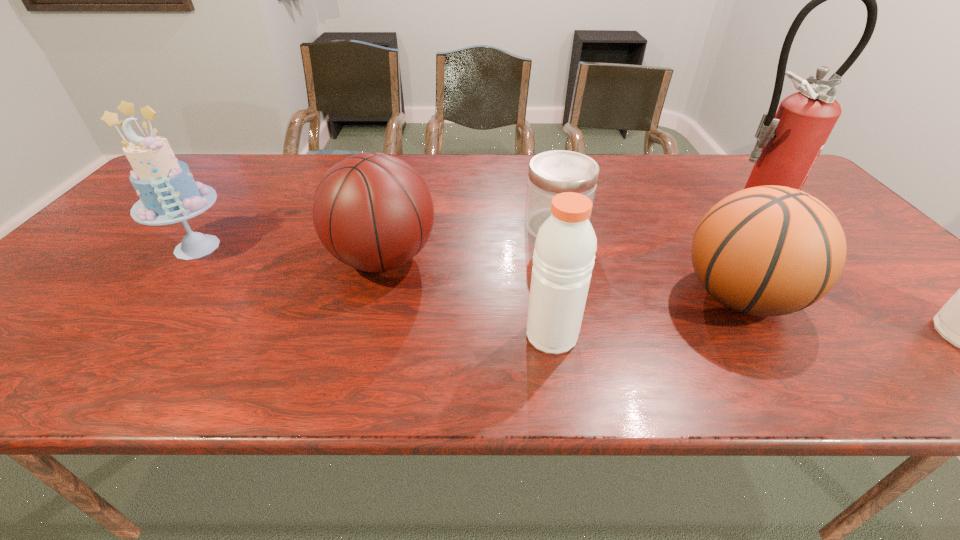
I want to click on vacant space positioned with a ladder on the side of the leftmost object, so click(168, 284).

Locate an element on the screen. The height and width of the screenshot is (540, 960). vacant space located 0.390m on the left of the right basketball is located at coordinates (505, 297).

Where is `shaker present at the near edge`? shaker present at the near edge is located at coordinates (565, 246).

This screenshot has height=540, width=960. Identify the location of basketball that is at the near edge. (770, 250).

Identify the location of object present at the right edge. (789, 142).

Identify the location of free location at the far edge. Image resolution: width=960 pixels, height=540 pixels. (444, 174).

Where is `free space at the near edge`? The image size is (960, 540). free space at the near edge is located at coordinates (151, 338).

Image resolution: width=960 pixels, height=540 pixels. In the image, there is a desktop. What are the coordinates of `free region at the left edge` in the screenshot? It's located at pos(98,294).

At what (x,y) coordinates should I click in order to perform the action: click on vacant space at the right edge. Please return your answer as a coordinate pair (x, y). Image resolution: width=960 pixels, height=540 pixels. Looking at the image, I should click on (877, 275).

Identify the location of vacant space at the far left corner. (207, 153).